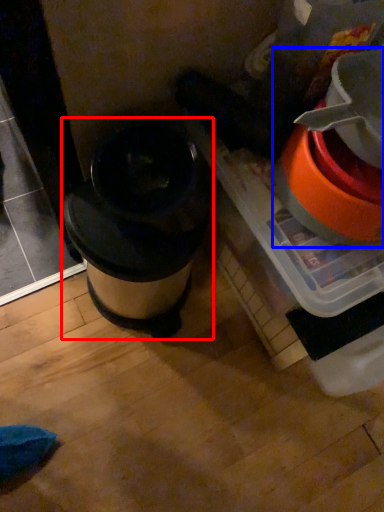
Question: Which object is further to the camera taking this photo, waste container (highlighted by a red box) or appliance (highlighted by a blue box)?

Choices:
 (A) waste container
 (B) appliance

Answer: (A)